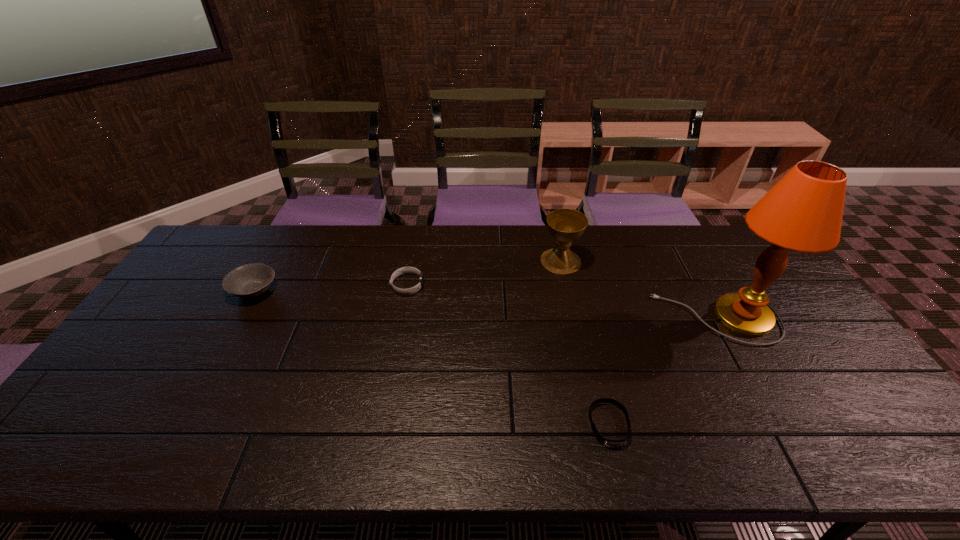
The height and width of the screenshot is (540, 960). I want to click on lamp, so click(x=803, y=212).

At what (x,y) coordinates should I click in order to perform the action: click on the rightmost object. Please return your answer as a coordinate pair (x, y). The height and width of the screenshot is (540, 960). Looking at the image, I should click on point(803,212).

This screenshot has height=540, width=960. Identify the location of the fourth shortest object. (565, 225).

Find the location of a particular element. The height and width of the screenshot is (540, 960). the third tallest object is located at coordinates (251, 280).

At what (x,y) coordinates should I click in order to perform the action: click on the leftmost object. Please return your answer as a coordinate pair (x, y). The height and width of the screenshot is (540, 960). Looking at the image, I should click on pos(251,280).

The width and height of the screenshot is (960, 540). Identify the location of the taller wristband. [x=409, y=291].

The height and width of the screenshot is (540, 960). Identify the location of the second shortest object. (409, 291).

The height and width of the screenshot is (540, 960). What are the coordinates of `the right wristband` in the screenshot? It's located at (609, 443).

Image resolution: width=960 pixels, height=540 pixels. Find the location of `the nearest object`. the nearest object is located at coordinates pyautogui.click(x=609, y=443).

Identify the location of vacant region located on the right of the lamp. Image resolution: width=960 pixels, height=540 pixels. (800, 318).